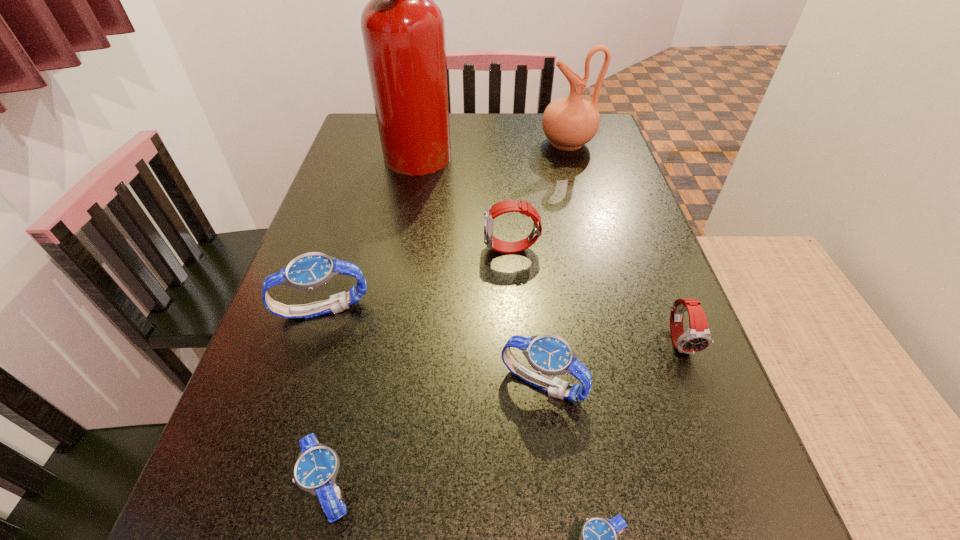
Identify the location of the second shortest watch. The height and width of the screenshot is (540, 960). (315, 471).

Find the location of a particular element. blank space located 0.070m with the handle and nozzle on the red fire extinguisher is located at coordinates (476, 149).

I want to click on vacant area situated on the spout of the seventh shortest object, so click(516, 143).

This screenshot has height=540, width=960. I want to click on free region located 0.310m on the spout of the seventh shortest object, so click(x=434, y=143).

In order to click on vacant position located 0.330m on the spout of the seventh shortest object in this screenshot , I will do `click(427, 143)`.

I want to click on vacant region located 0.060m on the face of the farther red watch, so click(x=457, y=249).

I want to click on blank space located 0.070m on the face of the farther red watch, so click(x=452, y=249).

At what (x,y) coordinates should I click in order to perform the action: click on vacant region located 0.340m on the face of the farther red watch. Please return your answer as a coordinate pair (x, y). The width and height of the screenshot is (960, 540). Looking at the image, I should click on (329, 249).

The image size is (960, 540). I want to click on vacant region located 0.300m on the back of the farthest blue watch, so click(358, 202).

The width and height of the screenshot is (960, 540). Find the location of `vacant region located 0.230m on the left of the third smallest blue watch`. vacant region located 0.230m on the left of the third smallest blue watch is located at coordinates (363, 384).